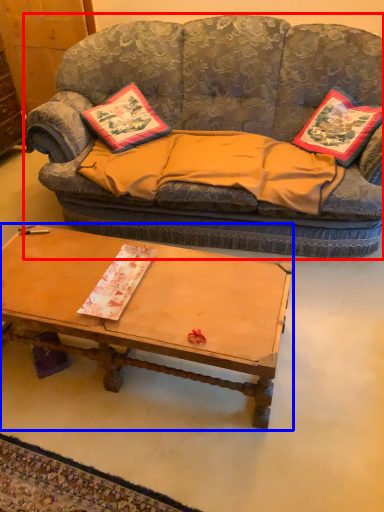
Question: Which object is further to the camera taking this photo, studio couch (highlighted by a red box) or coffee table (highlighted by a blue box)?

Choices:
 (A) studio couch
 (B) coffee table

Answer: (A)